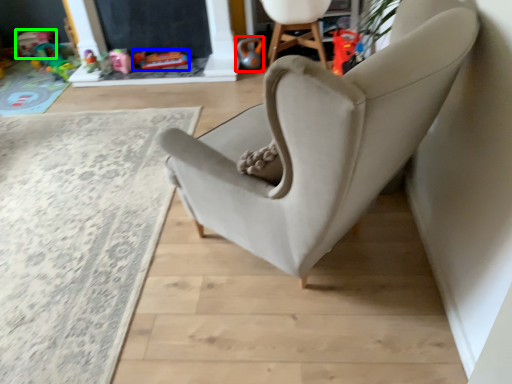
Question: Which object is positioned closest to toy (highlighted by a red box)? Select from toy (highlighted by a blue box) and toy (highlighted by a green box).

Choices:
 (A) toy
 (B) toy

Answer: (A)